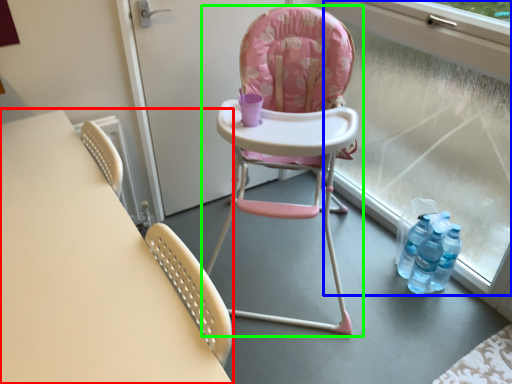
Question: Which object is positioned farthest from table (highlighted by a red box)? Select from window frame (highlighted by a blue box) and chair (highlighted by a green box).

Choices:
 (A) window frame
 (B) chair

Answer: (A)